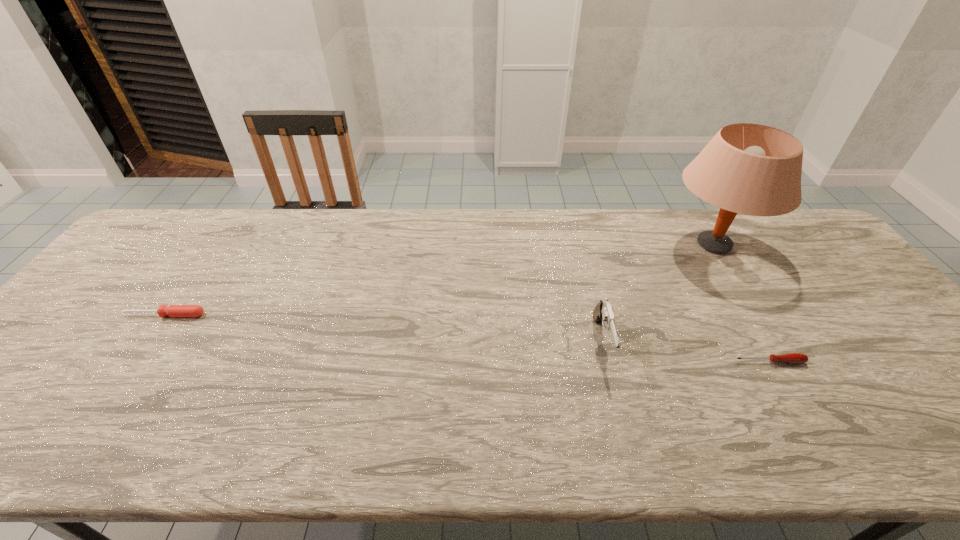
You are a GUI agent. You are given a task and a screenshot of the screen. Output one action in this format:
    pyautogui.click(x=<x>, y=<y>)
    Task: Click on the vacant position located 0.080m at the muzzle of the gun
    Image resolution: width=960 pixels, height=540 pixels.
    Given the screenshot: What is the action you would take?
    pyautogui.click(x=618, y=403)

Identify the location of vacant space located 0.370m on the right of the farther screwdriver. The width and height of the screenshot is (960, 540). (345, 315).

The width and height of the screenshot is (960, 540). In order to click on free spot located 0.100m on the back of the nearer screwdriver in this screenshot , I will do `click(749, 326)`.

Find the location of a particular element. This screenshot has height=540, width=960. object located in the far edge section of the desktop is located at coordinates (751, 169).

The height and width of the screenshot is (540, 960). What are the coordinates of `object that is at the left edge` in the screenshot? It's located at (173, 310).

Where is `vacant space at the far edge of the desktop`? vacant space at the far edge of the desktop is located at coordinates (209, 234).

Where is `vacant space at the near edge`? This screenshot has height=540, width=960. vacant space at the near edge is located at coordinates (773, 426).

Locate an element on the screen. vacant region at the right edge of the desktop is located at coordinates (879, 310).

You are a GUI agent. You are given a task and a screenshot of the screen. Output one action in this format:
    pyautogui.click(x=<x>, y=<y>)
    Task: Click on the vacant space at the far left corner
    The width and height of the screenshot is (960, 540).
    Given the screenshot: What is the action you would take?
    pyautogui.click(x=136, y=250)

At what (x,y) coordinates should I click in order to perform the action: click on free spot between the right screwdriver and the second object from left to right. Please return your answer as a coordinate pair (x, y). The height and width of the screenshot is (540, 960). Looking at the image, I should click on (686, 352).